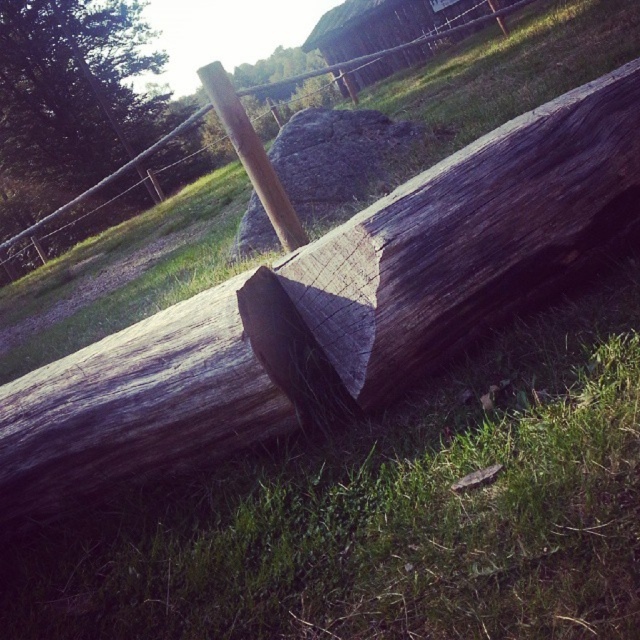
Question: Considering the real-world distances, which object is closest to the green grass at center?

Choices:
 (A) weathered wood log at center
 (B) weathered wood post at center
 (C) dark brown wood log at upper left

Answer: (A)

Question: Which object appears closest to the camera in this image?

Choices:
 (A) dark brown wood log at upper left
 (B) wooden post at center
 (C) weathered wood log at center
 (D) green grass at center

Answer: (D)

Question: Is weathered wood log at center bigger than dark brown wood log at upper left?

Choices:
 (A) no
 (B) yes

Answer: (A)

Question: Is green grass at center to the left of wooden post at center from the viewer's perspective?

Choices:
 (A) no
 (B) yes

Answer: (A)

Question: Is wooden post at center closer to camera compared to weathered wood post at center?

Choices:
 (A) yes
 (B) no

Answer: (A)

Question: Which of these objects is positioned closest to the dark brown wood log at upper left?

Choices:
 (A) green grass at center
 (B) weathered wood log at center
 (C) wooden post at center

Answer: (A)